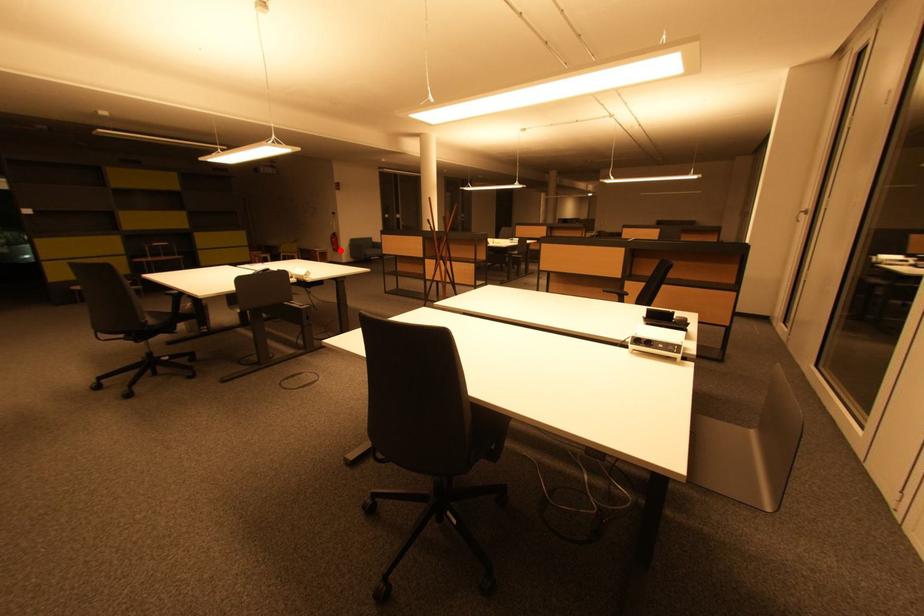
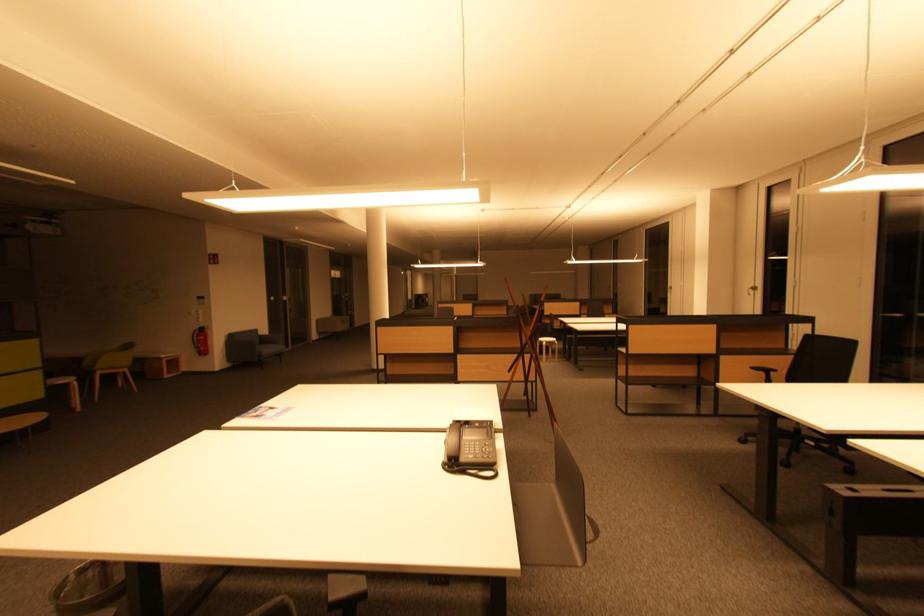
Find the pixel in the second image that matches the highlighted location in the first image.

(207, 353)